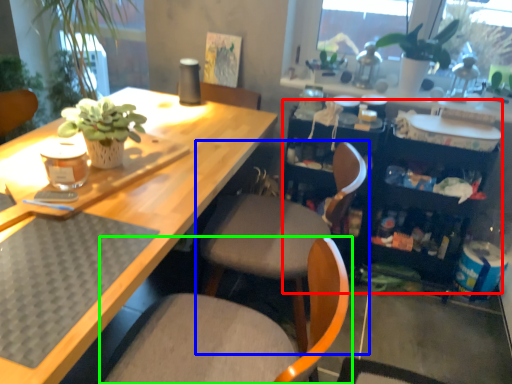
Question: Based on their relative distances, which object is farther from bookshelf (highlighted by a red box)? Choose from chair (highlighted by a blue box) and chair (highlighted by a green box).

Choices:
 (A) chair
 (B) chair

Answer: (B)